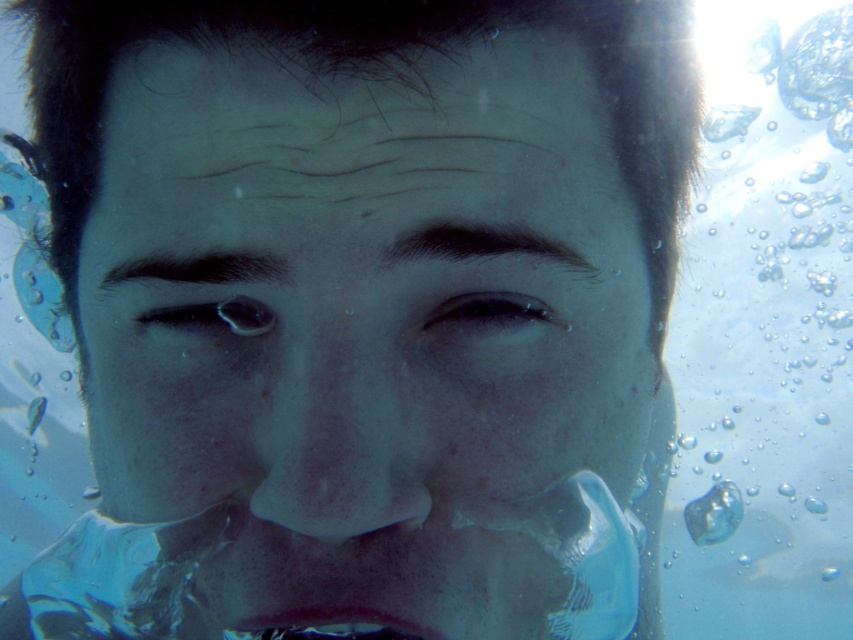
Question: Which point is closer to the camera?

Choices:
 (A) matte skin face at center
 (B) translucent blue lips at lower center
 (C) smooth skin nose at center

Answer: (A)

Question: Is smooth skin nose at center to the right of translucent blue lips at lower center from the viewer's perspective?

Choices:
 (A) no
 (B) yes

Answer: (B)

Question: Which point appears closest to the camera in this image?

Choices:
 (A) (357, 340)
 (B) (254, 164)
 (C) (325, 611)

Answer: (A)

Question: Where is matte skin face at center located in relation to smooth skin nose at center in the image?

Choices:
 (A) right
 (B) left

Answer: (A)

Question: Estimate the real-world distances between objects in this image. Which object is closer to the translucent blue lips at lower center?

Choices:
 (A) smooth skin nose at center
 (B) matte skin face at center

Answer: (A)

Question: Is matte skin face at center above smooth skin nose at center?

Choices:
 (A) no
 (B) yes

Answer: (B)